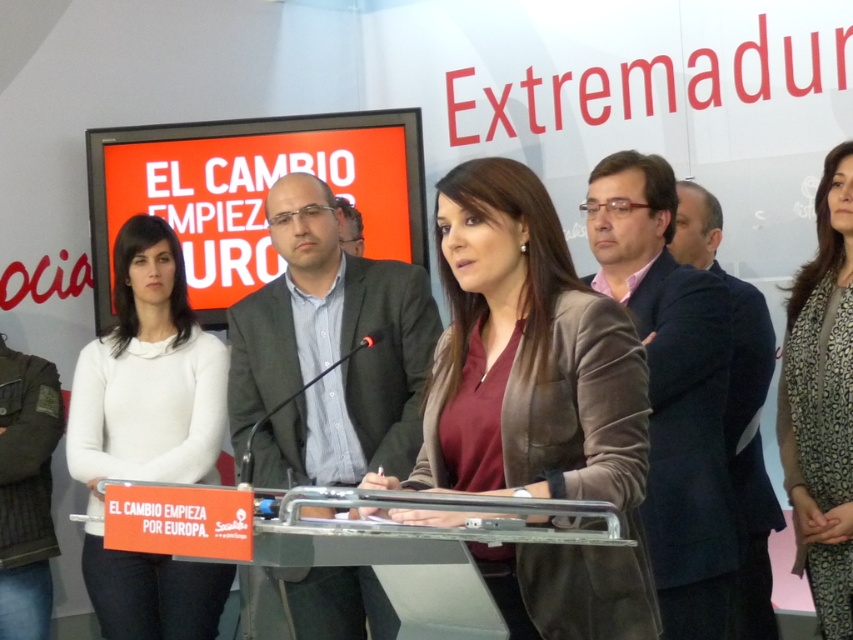
Who is positioned more to the right, brown leather jacket at center or white matte sweater at center?

brown leather jacket at center

Between point (496, 344) and point (83, 451), which one is positioned in front?

Point (496, 344) is more forward.

Describe the element at coordinates (535, 404) in the screenshot. The height and width of the screenshot is (640, 853). I see `brown leather jacket at center` at that location.

Locate an element on the screen. The width and height of the screenshot is (853, 640). brown leather jacket at center is located at coordinates (535, 404).

Locate an element on the screen. Image resolution: width=853 pixels, height=640 pixels. white matte sweater at center is located at coordinates (148, 376).

Can you confirm if white matte sweater at center is bigger than brown textured coat at center?

Yes.

Is point (142, 236) less distant than point (799, 536)?

No, (142, 236) is further to viewer.

The image size is (853, 640). In order to click on white matte sweater at center in this screenshot , I will do `click(148, 376)`.

Which is behind, point (619, 424) or point (840, 163)?

Point (840, 163)

Where is `brown leather jacket at center`? Image resolution: width=853 pixels, height=640 pixels. brown leather jacket at center is located at coordinates (535, 404).